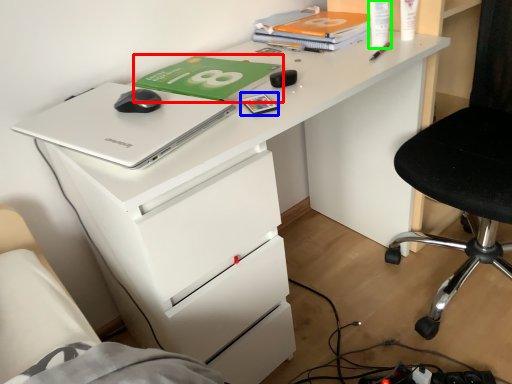
Question: Considering the real-world distances, which object is closest to paperback book (highlighted by a red box)? stationery (highlighted by a blue box) or stationery (highlighted by a green box).

Choices:
 (A) stationery
 (B) stationery

Answer: (A)